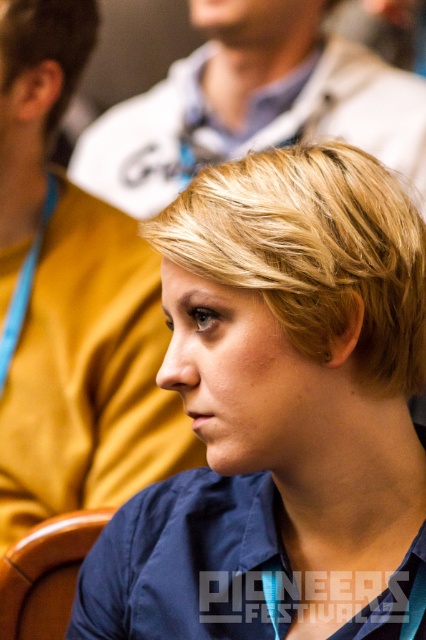
Who is higher up, blondehair at center or brown leather chair at lower left?

blondehair at center is above.

Which is more to the left, blondehair at center or brown leather chair at lower left?

brown leather chair at lower left is more to the left.

What do you see at coordinates (313, 250) in the screenshot? I see `blondehair at center` at bounding box center [313, 250].

This screenshot has height=640, width=426. Find the location of `blondehair at center`. blondehair at center is located at coordinates (313, 250).

Is blue fabric shirt at center wider than blonde hair at upper left?

Indeed, blue fabric shirt at center has a greater width compared to blonde hair at upper left.

Does blue fabric shirt at center have a larger size compared to blonde hair at upper left?

Correct, blue fabric shirt at center is larger in size than blonde hair at upper left.

Is point (131, 579) closer to camera compared to point (94, 28)?

Yes, point (131, 579) is in front of point (94, 28).

You are a GUI agent. You are given a task and a screenshot of the screen. Output one action in this format:
    pyautogui.click(x=<x>, y=<y>)
    Task: Click on the blue fabric shirt at center
    
    Given the screenshot: What is the action you would take?
    pyautogui.click(x=281, y=413)

Is blondehair at center to the left of blonde hair at upper left from the viewer's perspective?

Incorrect, blondehair at center is not on the left side of blonde hair at upper left.

Who is shorter, blondehair at center or blonde hair at upper left?

Standing shorter between the two is blonde hair at upper left.

Does point (342, 305) come behind point (57, 109)?

No, (342, 305) is closer to viewer.

In order to click on blondehair at center in this screenshot , I will do `click(313, 250)`.